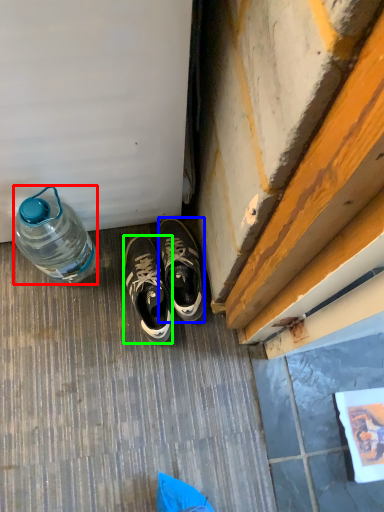
Question: Which object is the farthest from bottle (highlighted by a red box)? Choose among these: sneakers (highlighted by a blue box) or sneakers (highlighted by a green box).

Choices:
 (A) sneakers
 (B) sneakers

Answer: (A)